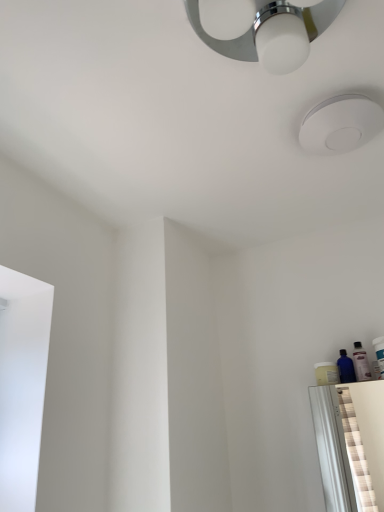
Question: Can you confirm if translucent plastic bottle at right, acting as the 2th toiletry starting from the right, is positioned to the right of white plastic toothbrush at right, which ranks as the second toiletry in left-to-right order?

Choices:
 (A) yes
 (B) no

Answer: (B)

Question: Does translucent plastic bottle at right, the 1th toiletry positioned from the left, have a lesser height compared to white plastic toothbrush at right, which ranks as the second toiletry in left-to-right order?

Choices:
 (A) no
 (B) yes

Answer: (A)

Question: Does translucent plastic bottle at right, the 1th toiletry positioned from the left, have a greater width compared to white plastic toothbrush at right, which is the 1th toiletry in right-to-left order?

Choices:
 (A) yes
 (B) no

Answer: (B)

Question: Considering the relative sizes of translucent plastic bottle at right, acting as the 2th toiletry starting from the right, and white plastic toothbrush at right, which ranks as the second toiletry in left-to-right order, in the image provided, is translucent plastic bottle at right, acting as the 2th toiletry starting from the right, thinner than white plastic toothbrush at right, which ranks as the second toiletry in left-to-right order,?

Choices:
 (A) yes
 (B) no

Answer: (A)

Question: Is translucent plastic bottle at right, acting as the 2th toiletry starting from the right, closer to the viewer compared to white plastic toothbrush at right, which is the 1th toiletry in right-to-left order?

Choices:
 (A) no
 (B) yes

Answer: (A)

Question: Could you tell me if translucent plastic bottle at right, the 1th toiletry positioned from the left, is facing white plastic toothbrush at right, which is the 1th toiletry in right-to-left order?

Choices:
 (A) yes
 (B) no

Answer: (B)

Question: From a real-world perspective, is white matte droplight at upper center below translucent plastic bottle at right, the 1th toiletry positioned from the left?

Choices:
 (A) no
 (B) yes

Answer: (A)

Question: Does white matte droplight at upper center come behind translucent plastic bottle at right, the 1th toiletry positioned from the left?

Choices:
 (A) yes
 (B) no

Answer: (B)

Question: Is white matte droplight at upper center not near translucent plastic bottle at right, acting as the 2th toiletry starting from the right?

Choices:
 (A) no
 (B) yes

Answer: (A)

Question: From a real-world perspective, is white matte droplight at upper center over translucent plastic bottle at right, the 1th toiletry positioned from the left?

Choices:
 (A) no
 (B) yes

Answer: (B)

Question: Can you confirm if white matte droplight at upper center is taller than translucent plastic bottle at right, acting as the 2th toiletry starting from the right?

Choices:
 (A) yes
 (B) no

Answer: (B)

Question: Is white matte droplight at upper center oriented towards translucent plastic bottle at right, the 1th toiletry positioned from the left?

Choices:
 (A) no
 (B) yes

Answer: (A)

Question: Can you confirm if white matte droplight at upper center is shorter than white plastic toothbrush at right, which is the 1th toiletry in right-to-left order?

Choices:
 (A) no
 (B) yes

Answer: (B)